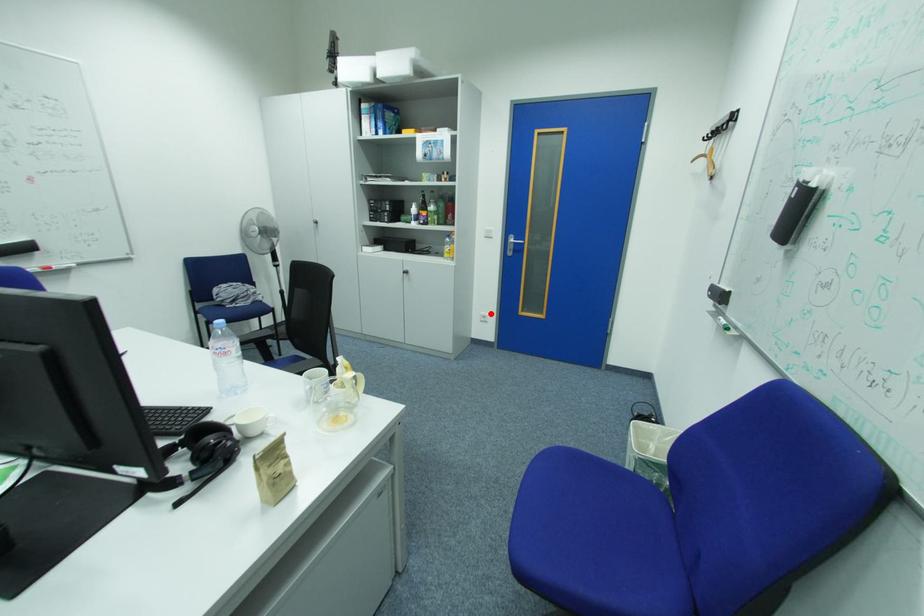
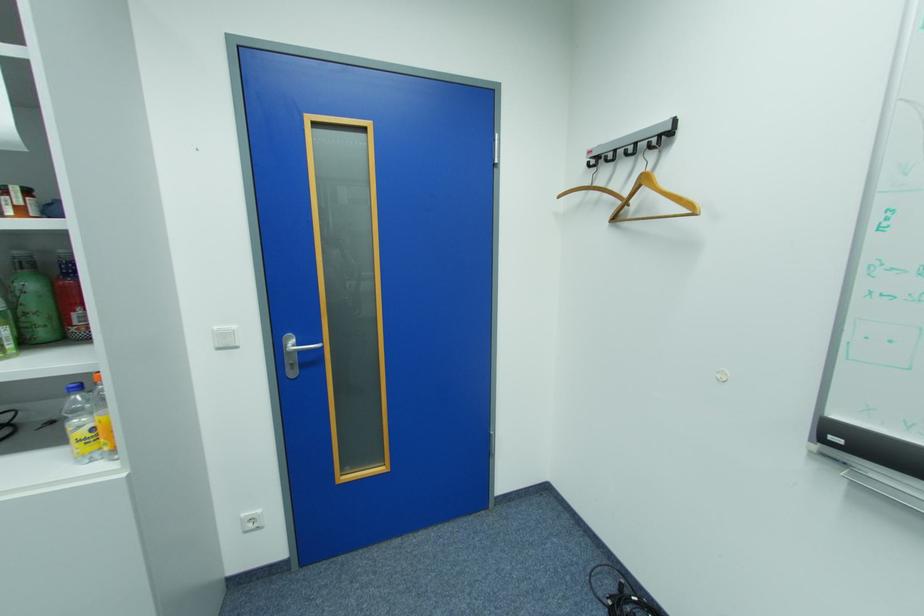
Locate, in the second image, the point that corresponds to the highlighted location in the first image.

(252, 516)